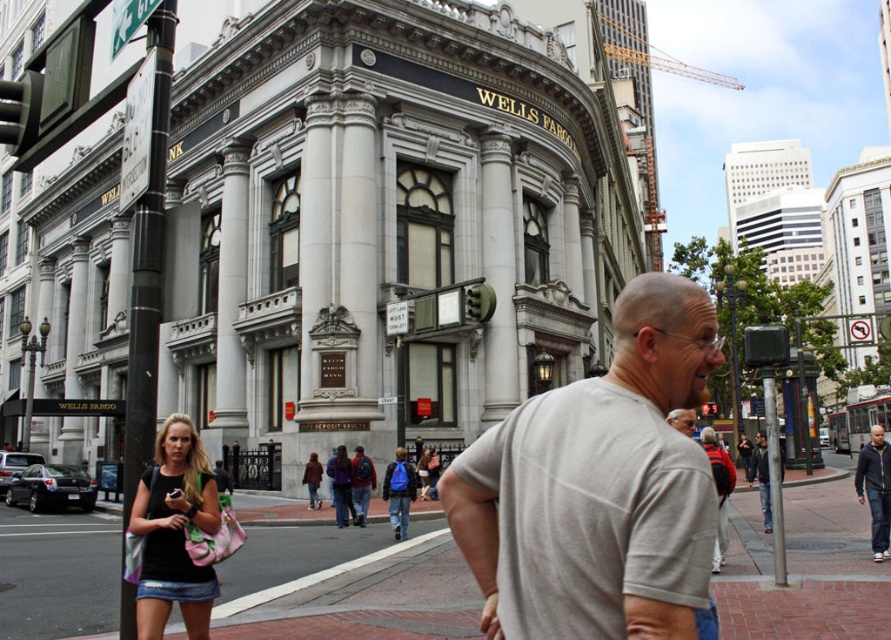
You are a delivery person trying to place a package on the brick pavement at center. Can you confirm if the dark blue jacket at right is tall enough to block the package from being seen from above?

The brick pavement at center has a lesser height compared to dark blue jacket at right, so the dark blue jacket at right is taller and can block the package from being seen from above.